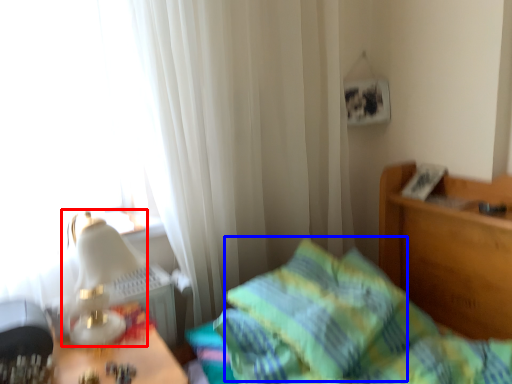
Question: Which of the following is the closest to the observer, table lamp (highlighted by a red box) or pillow (highlighted by a blue box)?

Choices:
 (A) table lamp
 (B) pillow

Answer: (A)